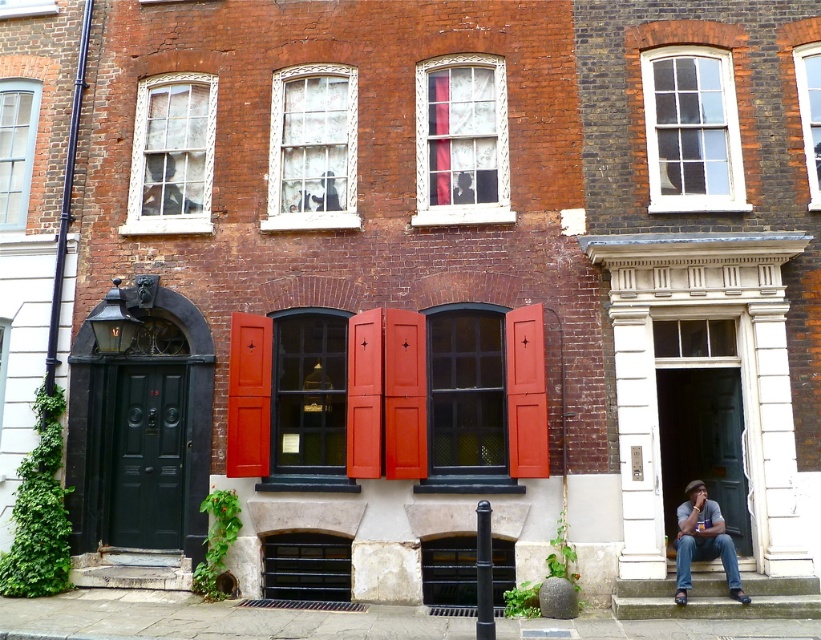
Question: Which object appears closest to the camera in this image?

Choices:
 (A) matte black window at center
 (B) white glass window at upper right
 (C) matte glass window at center
 (D) clear glass window at center

Answer: (A)

Question: Is white textured glass window at center wider than clear glass window at center?

Choices:
 (A) no
 (B) yes

Answer: (B)

Question: Which point appears farthest from the camera in this image?

Choices:
 (A) (492, 320)
 (B) (315, 424)
 (C) (679, 106)

Answer: (C)

Question: Does white glass window at upper right appear over concrete stairs at lower right?

Choices:
 (A) yes
 (B) no

Answer: (A)

Question: Which point appears closest to the camera in this image?

Choices:
 (A) (30, 140)
 (B) (434, 310)
 (C) (698, 100)

Answer: (B)

Question: Considering the relative positions of matte glass window at center and concrete stairs at lower right in the image provided, where is matte glass window at center located with respect to concrete stairs at lower right?

Choices:
 (A) right
 (B) left

Answer: (B)